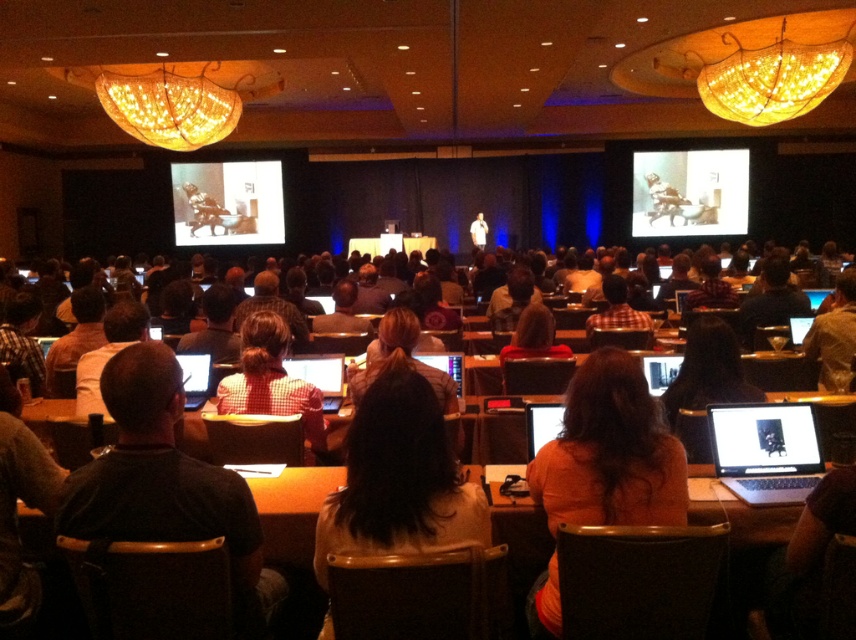
You are an event organizer who needs to ensure all speakers are visible to the audience. You notice two shirts at the center of the stage. Which shirt, the orange fabric shirt at center or the white shirt at center, is more likely to be seen clearly from the back row?

The white shirt at center is more likely to be seen clearly from the back row because it is larger than the orange fabric shirt at center.

You are an event organizer preparing to place a 12 inch wide name tag on the podium. You notice the orange fabric shirt at center and the white shirt at center on the stage. Which shirt should you choose to ensure the name tag fits without overlapping the shirt?

The orange fabric shirt at center has a greater width than the white shirt at center. Since the name tag is 12 inches wide, the orange fabric shirt at center provides more space, so placing the name tag there would prevent overlapping.